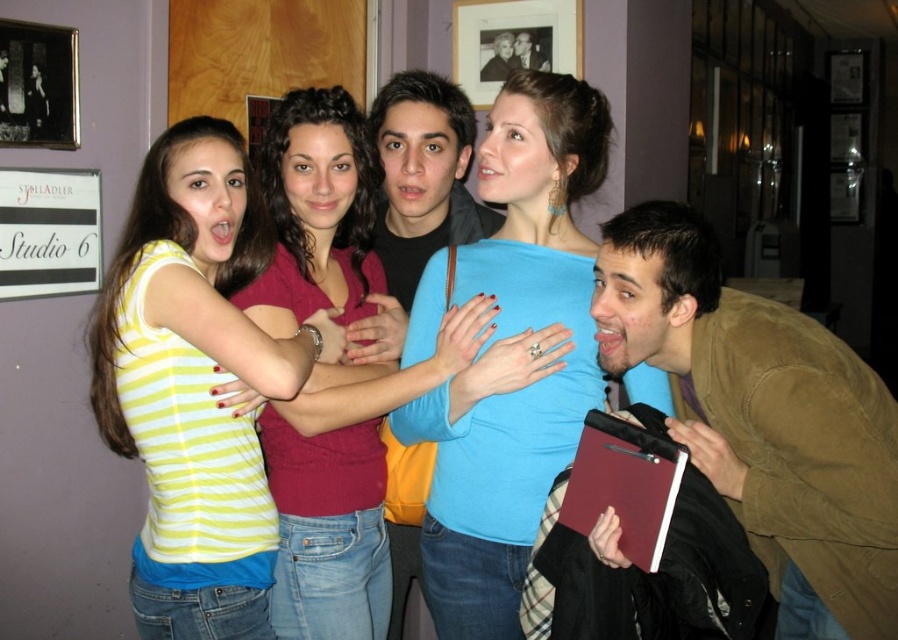
Question: Which object is farther from the camera taking this photo?

Choices:
 (A) matte black jacket at upper center
 (B) yellow striped shirt at upper left
 (C) smooth brown leather jacket at center

Answer: (A)

Question: Does yellow striped shirt at upper left have a lesser width compared to black matte shirt at center?

Choices:
 (A) yes
 (B) no

Answer: (B)

Question: Can you confirm if brown suede jacket at lower right is thinner than matte maroon top at center?

Choices:
 (A) yes
 (B) no

Answer: (B)

Question: Estimate the real-world distances between objects in this image. Which object is farther from the brown suede jacket at lower right?

Choices:
 (A) smooth brown leather jacket at center
 (B) black matte shirt at center
 (C) blue matte shirt at center
 (D) matte black jacket at upper center

Answer: (D)

Question: Does matte maroon top at center lie in front of smooth brown leather jacket at center?

Choices:
 (A) yes
 (B) no

Answer: (A)

Question: Which of the following is the farthest from the observer?

Choices:
 (A) (350, 141)
 (B) (138, 272)
 (C) (867, 454)

Answer: (A)